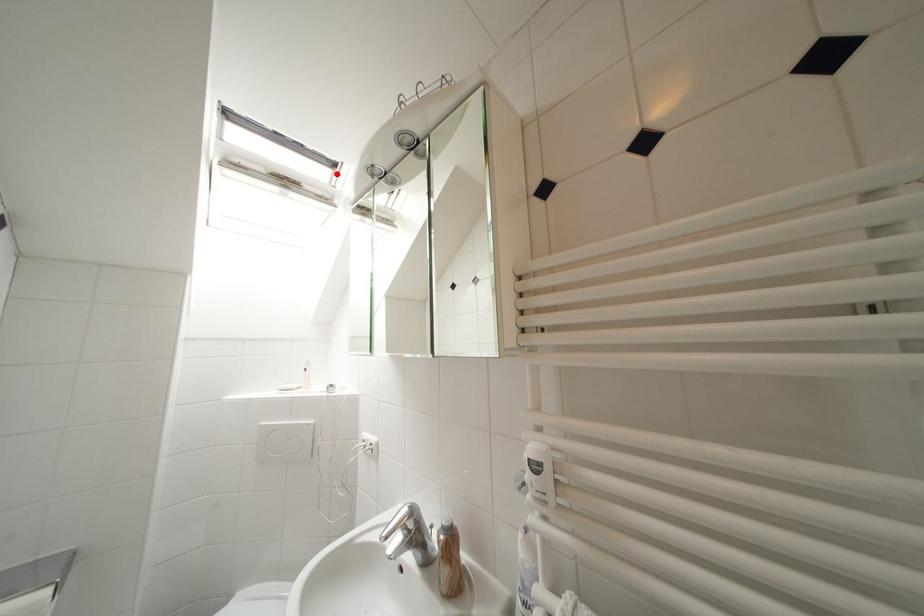
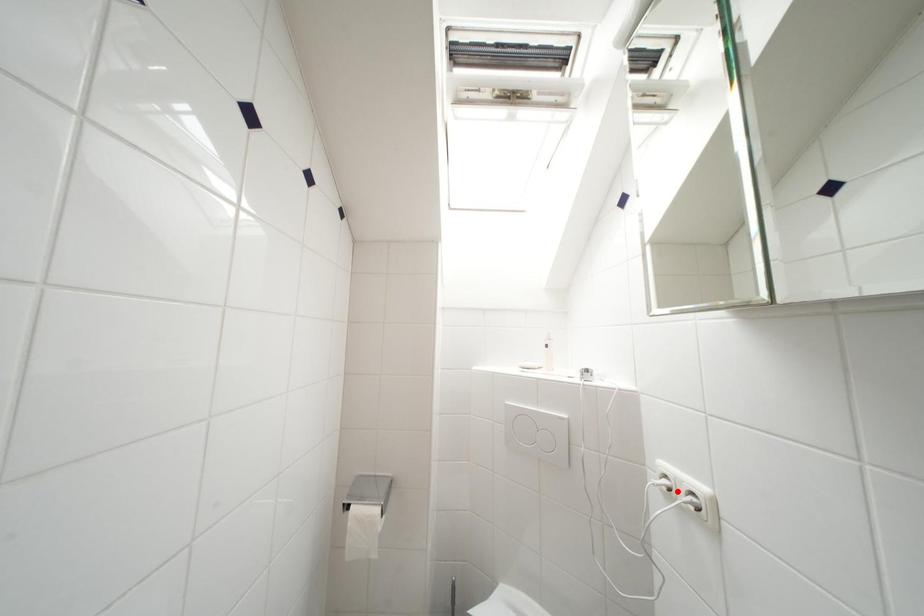
I am providing you with two images of the same scene from different viewpoints. A red point is marked on the first image and another point is marked on the second image. Does the point marked in image1 correspond to the same location as the one in image2?

No